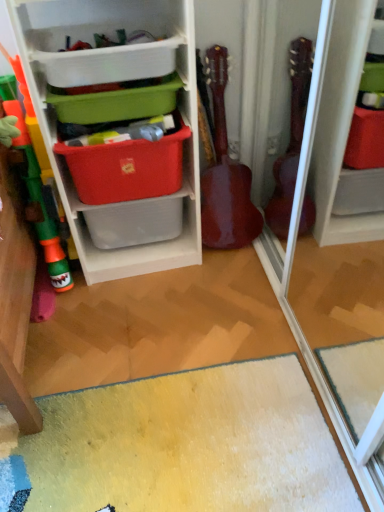
Question: Is the surface of green plastic storage box at upper center, the 1th storage box positioned from the top, in direct contact with red fabric storage box at center, the first storage box from the bottom?

Choices:
 (A) no
 (B) yes

Answer: (A)

Question: Does green plastic storage box at upper center, the 1th storage box positioned from the top, appear on the right side of red fabric storage box at center, which is the 3th storage box from top to bottom?

Choices:
 (A) no
 (B) yes

Answer: (A)

Question: Does green plastic storage box at upper center, which ranks as the third storage box in bottom-to-top order, lie behind red fabric storage box at center, which is the 3th storage box from top to bottom?

Choices:
 (A) yes
 (B) no

Answer: (B)

Question: From a real-world perspective, is green plastic storage box at upper center, the 1th storage box positioned from the top, over red fabric storage box at center, which is the 3th storage box from top to bottom?

Choices:
 (A) yes
 (B) no

Answer: (A)

Question: From a real-world perspective, is red fabric storage box at center, which is the 3th storage box from top to bottom, above or below plastic storage at left?

Choices:
 (A) below
 (B) above

Answer: (A)

Question: Choose the correct answer: Is red fabric storage box at center, which is the 3th storage box from top to bottom, inside plastic storage at left or outside it?

Choices:
 (A) outside
 (B) inside

Answer: (B)

Question: Based on their positions, is red fabric storage box at center, which is the 3th storage box from top to bottom, located to the left or right of plastic storage at left?

Choices:
 (A) left
 (B) right

Answer: (B)

Question: From the image's perspective, relative to plastic storage at left, is red fabric storage box at center, which is the 3th storage box from top to bottom, above or below?

Choices:
 (A) above
 (B) below

Answer: (B)

Question: Considering the positions of green plastic storage box at upper center, the 1th storage box positioned from the top, and matte plastic storage box at upper center, which is the 2th storage box in top-to-bottom order, in the image, is green plastic storage box at upper center, the 1th storage box positioned from the top, taller or shorter than matte plastic storage box at upper center, which is the 2th storage box in top-to-bottom order,?

Choices:
 (A) short
 (B) tall

Answer: (B)

Question: Visually, is green plastic storage box at upper center, the 1th storage box positioned from the top, positioned to the left or to the right of matte plastic storage box at upper center, which is the 2th storage box in top-to-bottom order?

Choices:
 (A) right
 (B) left

Answer: (B)

Question: Is green plastic storage box at upper center, the 1th storage box positioned from the top, situated inside matte plastic storage box at upper center, the 2th storage box from the bottom, or outside?

Choices:
 (A) outside
 (B) inside

Answer: (A)

Question: Considering the positions of point (69, 57) and point (87, 119), is point (69, 57) closer or farther from the camera than point (87, 119)?

Choices:
 (A) closer
 (B) farther

Answer: (A)

Question: From a real-world perspective, is green plastic storage box at upper center, which ranks as the third storage box in bottom-to-top order, above or below plastic storage at left?

Choices:
 (A) above
 (B) below

Answer: (A)

Question: Looking at the image, does green plastic storage box at upper center, the 1th storage box positioned from the top, seem bigger or smaller compared to plastic storage at left?

Choices:
 (A) small
 (B) big

Answer: (A)